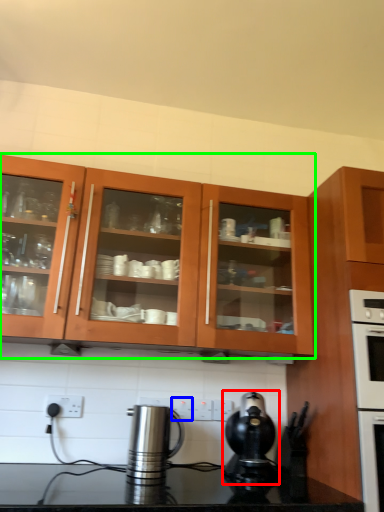
Question: Estimate the real-world distances between objects in this image. Which object is farther from kitchen appliance (highlighted by a red box), electric outlet (highlighted by a blue box) or cabinetry (highlighted by a green box)?

Choices:
 (A) electric outlet
 (B) cabinetry

Answer: (B)